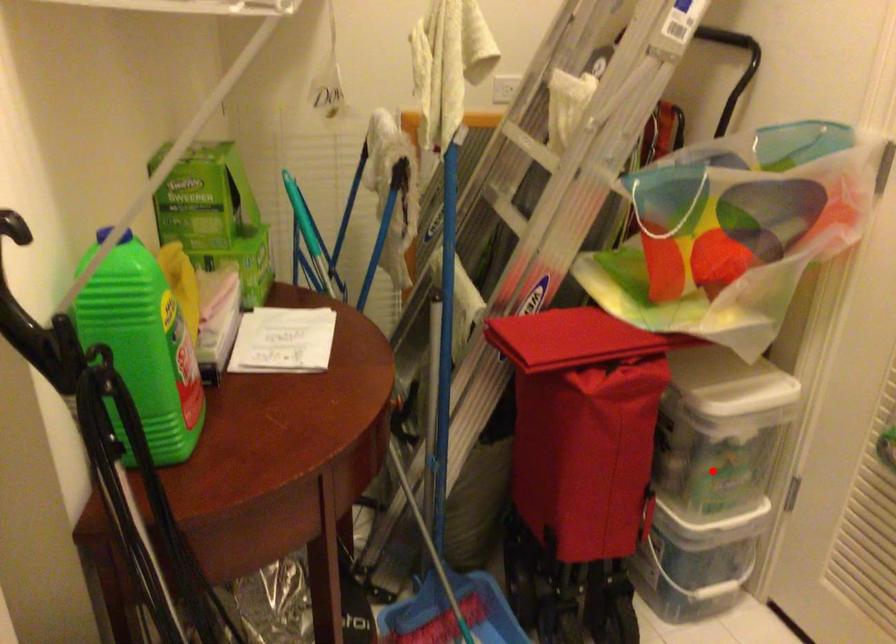
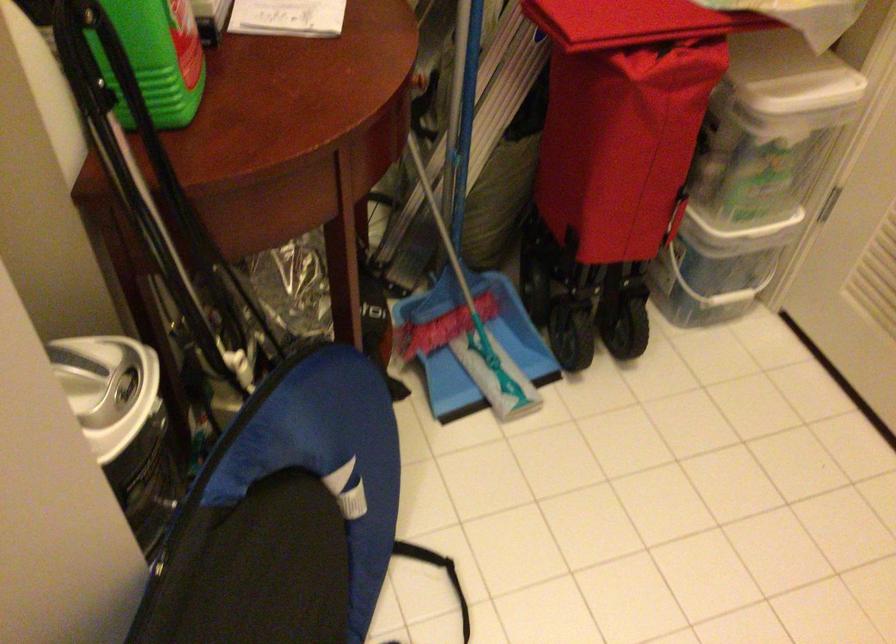
In the second image, find the point that corresponds to the highlighted location in the first image.

(752, 174)